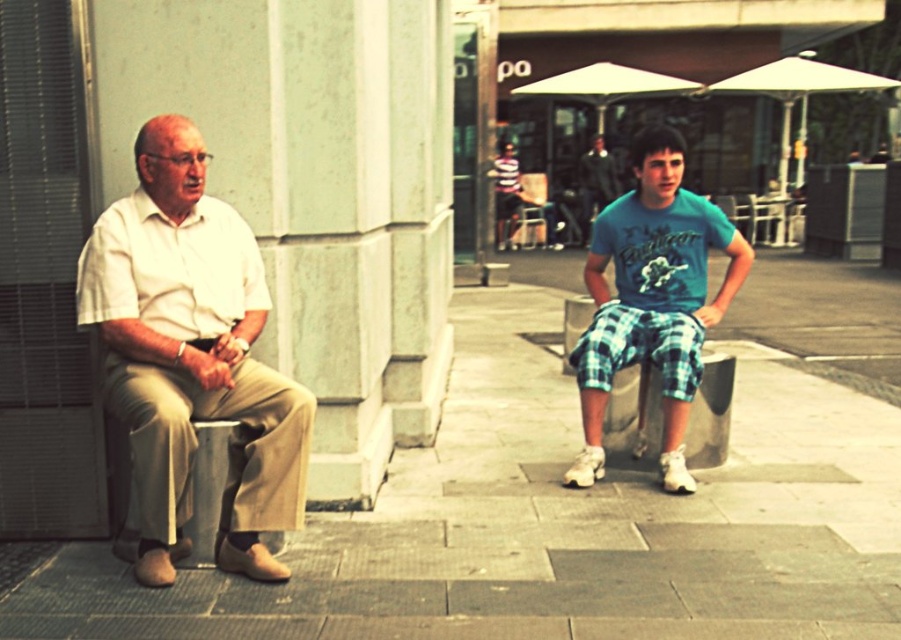
You are a delivery person who needs to place a small package on the ground between the smooth concrete pavement at center and the green plaid shorts at center. Which surface should you choose to ensure the package stays visible and doesn

The smooth concrete pavement at center is shorter than green plaid shorts at center. Therefore, placing the package on the smooth concrete pavement at center will keep it more visible since it is lower and less likely to be obscured by the shorts.

You are a delivery person who needs to place a small package between the white cotton shirt at left and the green plaid shorts at center. The package requires at least 5 feet of space to fit. Can you fit it there?

The white cotton shirt at left is 6.29 feet from the green plaid shorts at center, so yes, the package can fit between them since the distance is more than 5 feet.